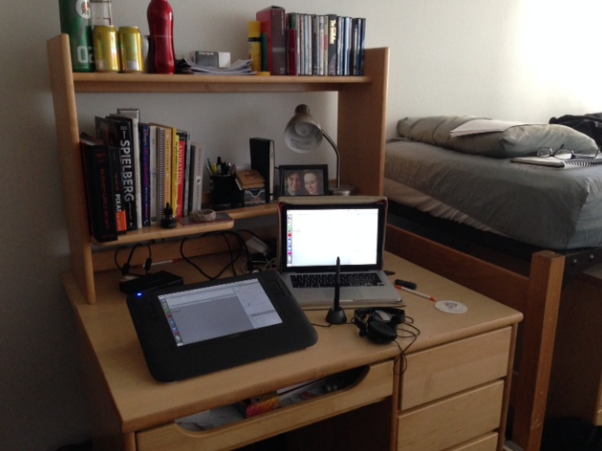
This screenshot has width=602, height=451. Identify the location of laptop. (330, 230).